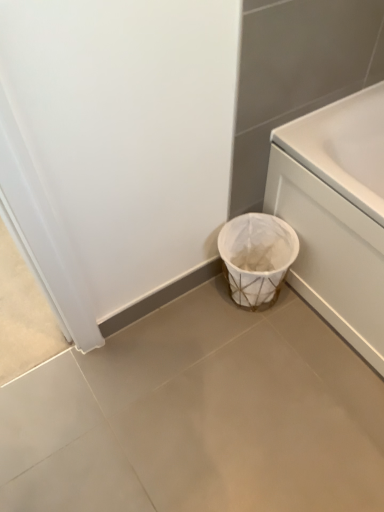
At what (x,y) coordinates should I click in order to perform the action: click on vacant area situated below white woven basket at lower center (from a real-world perspective). Please return your answer as a coordinate pair (x, y). Looking at the image, I should click on (249, 307).